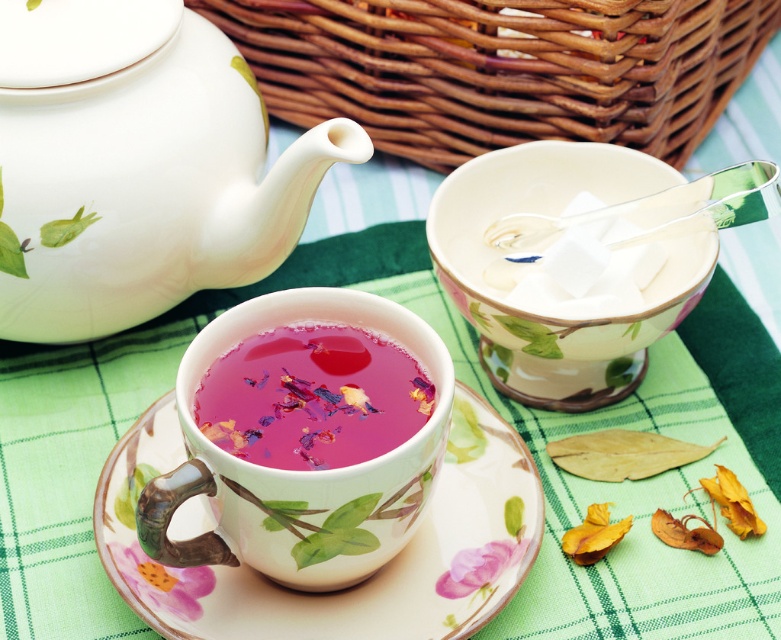
Can you confirm if white glossy teapot at upper left is smaller than pink floral tea at center?

No.

Looking at this image, does white glossy teapot at upper left have a lesser width compared to pink floral tea at center?

In fact, white glossy teapot at upper left might be wider than pink floral tea at center.

Which is behind, point (12, 296) or point (218, 362)?

The point (12, 296) is behind.

What are the coordinates of `white glossy teapot at upper left` in the screenshot? It's located at (138, 164).

Which is more to the left, white glossy teapot at upper left or brown woven basket at upper center?

white glossy teapot at upper left is more to the left.

Does white glossy teapot at upper left have a greater height compared to brown woven basket at upper center?

Yes.

Identify the location of white glossy teapot at upper left. (138, 164).

Locate an element on the screen. white glossy teapot at upper left is located at coordinates (138, 164).

Does porcelain saucer at center have a larger size compared to matte porcelain teacup at center?

Yes.

Identify the location of porcelain saucer at center. (366, 579).

Where is `porcelain saucer at center`? porcelain saucer at center is located at coordinates (366, 579).